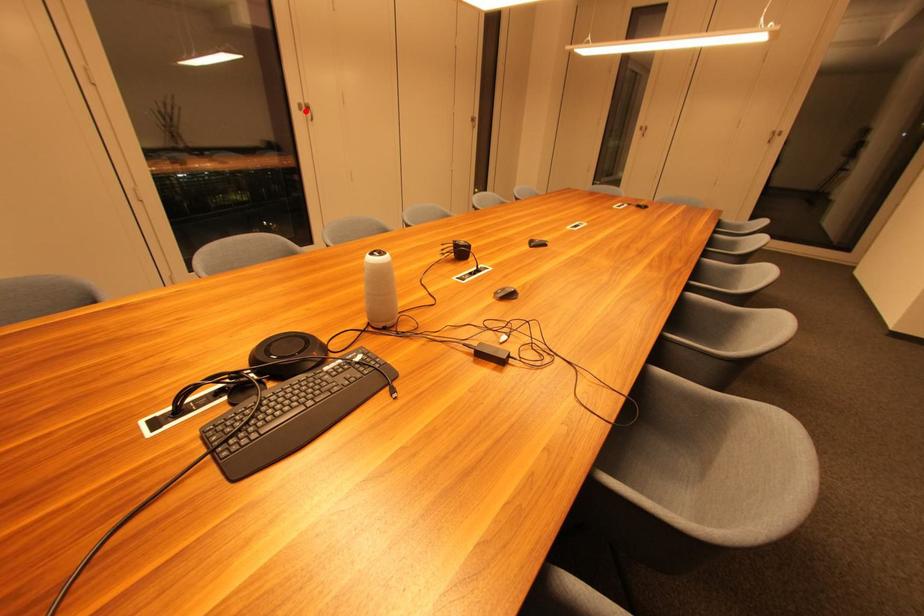
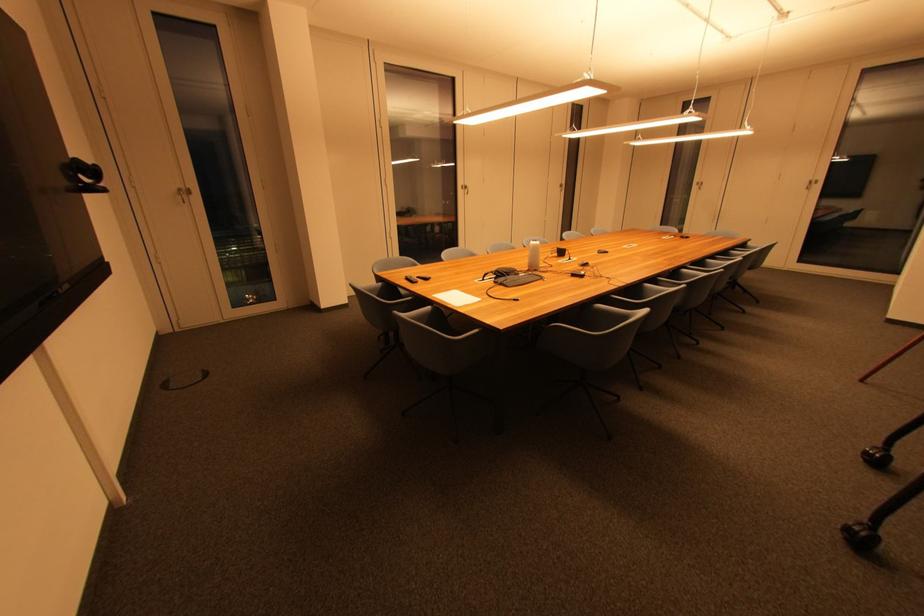
The point at the highlighted location is marked in the first image. Where is the corresponding point in the second image?

(468, 190)